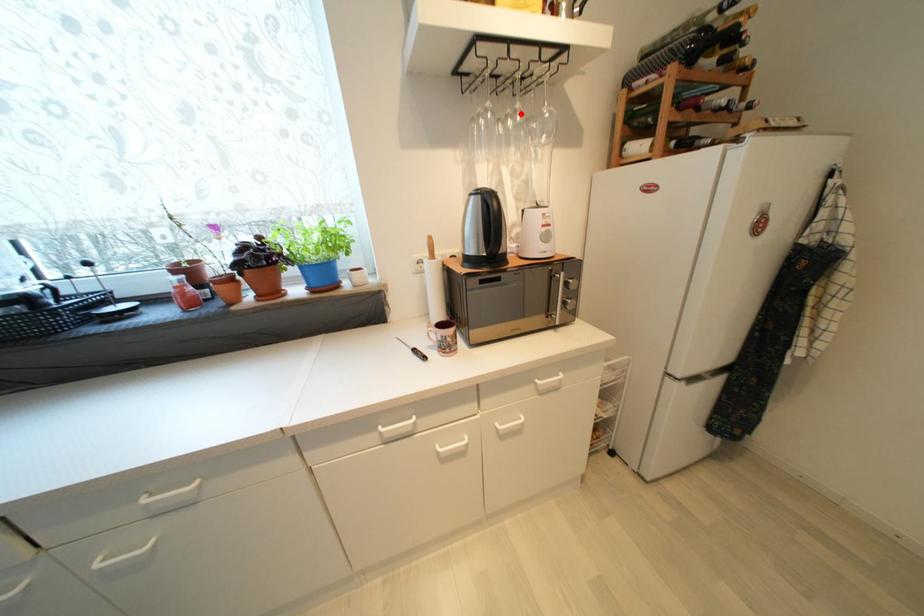
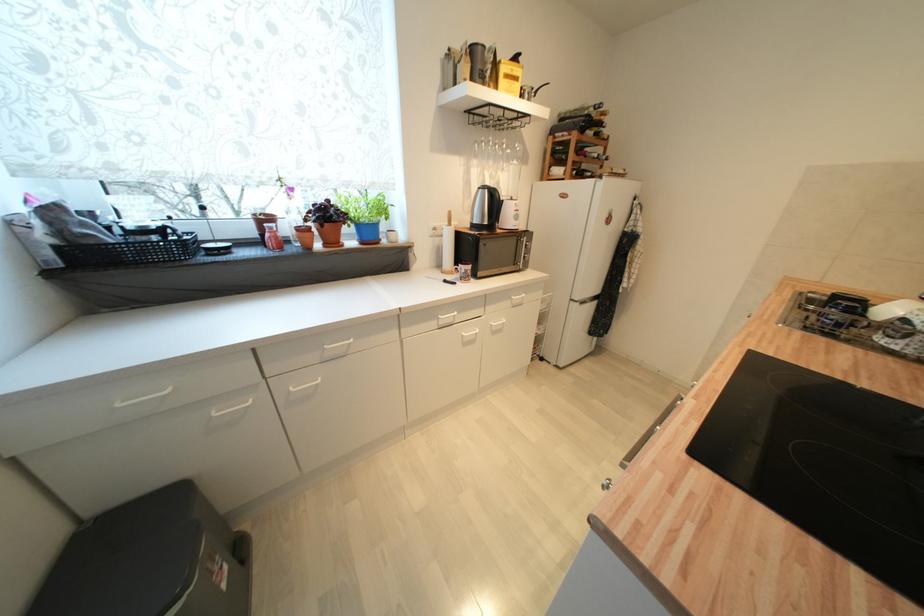
Find the pixel in the second image that matches the highlighted location in the first image.

(507, 146)